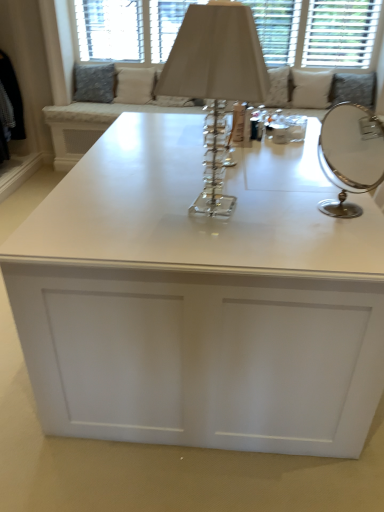
Question: Considering the relative sizes of silver/metallic round mirror at right and beige fabric pillow at upper center, positioned as the 2th pillow in right-to-left order, in the image provided, is silver/metallic round mirror at right shorter than beige fabric pillow at upper center, positioned as the 2th pillow in right-to-left order,?

Choices:
 (A) no
 (B) yes

Answer: (B)

Question: Is silver/metallic round mirror at right looking in the opposite direction of beige fabric pillow at upper center, positioned as the 2th pillow in right-to-left order?

Choices:
 (A) no
 (B) yes

Answer: (A)

Question: Is the depth of silver/metallic round mirror at right greater than that of beige fabric pillow at upper center, positioned as the 2th pillow in right-to-left order?

Choices:
 (A) yes
 (B) no

Answer: (B)

Question: Is silver/metallic round mirror at right to the left of beige fabric pillow at upper center, arranged as the 2th pillow when viewed from the left, from the viewer's perspective?

Choices:
 (A) no
 (B) yes

Answer: (A)

Question: Does silver/metallic round mirror at right touch beige fabric pillow at upper center, positioned as the 2th pillow in right-to-left order?

Choices:
 (A) no
 (B) yes

Answer: (A)

Question: From a real-world perspective, is silver/metallic round mirror at right positioned over beige fabric pillow at upper center, positioned as the 2th pillow in right-to-left order, based on gravity?

Choices:
 (A) no
 (B) yes

Answer: (B)

Question: Can you confirm if silver/metallic round mirror at right is smaller than white glossy table at center?

Choices:
 (A) no
 (B) yes

Answer: (B)

Question: From a real-world perspective, is silver/metallic round mirror at right located beneath white glossy table at center?

Choices:
 (A) no
 (B) yes

Answer: (A)

Question: From the image's perspective, would you say silver/metallic round mirror at right is positioned over white glossy table at center?

Choices:
 (A) no
 (B) yes

Answer: (B)

Question: Is silver/metallic round mirror at right not inside white glossy table at center?

Choices:
 (A) no
 (B) yes

Answer: (B)

Question: Would you say silver/metallic round mirror at right contains white glossy table at center?

Choices:
 (A) yes
 (B) no

Answer: (B)

Question: Is silver/metallic round mirror at right positioned with its back to white glossy table at center?

Choices:
 (A) yes
 (B) no

Answer: (B)

Question: Would you say white fabric pillow at upper right, acting as the 1th pillow starting from the right, contains white fabric cushion at upper center?

Choices:
 (A) no
 (B) yes

Answer: (A)